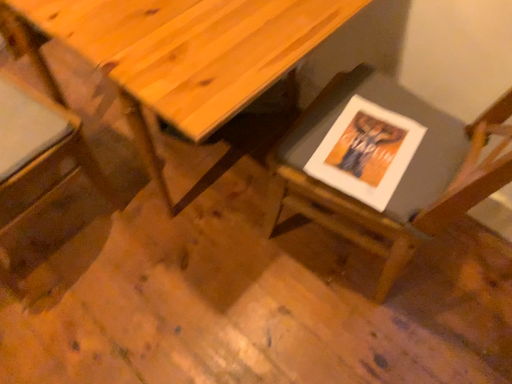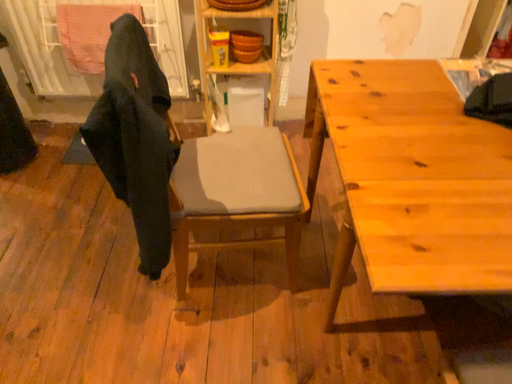
Question: How did the camera likely rotate when shooting the video?

Choices:
 (A) rotated left
 (B) rotated right

Answer: (A)